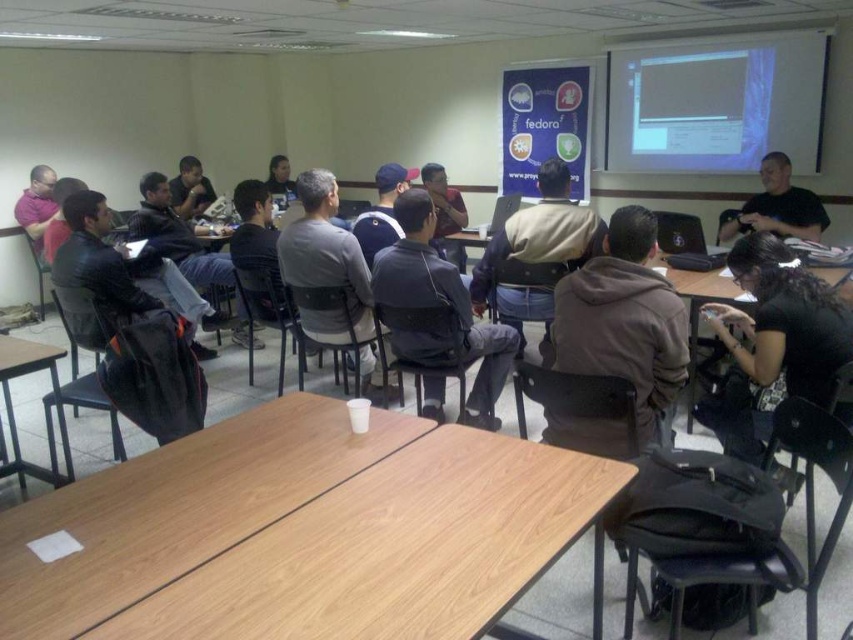
Question: Is brown wooden table at lower left thinner than matte black shirt at center?

Choices:
 (A) no
 (B) yes

Answer: (A)

Question: Which of these objects is positioned farthest from the brown wooden table at lower left?

Choices:
 (A) matte gray hoodie at center
 (B) matte black shirt at upper center

Answer: (B)

Question: Among these objects, which one is farthest from the camera?

Choices:
 (A) dark gray sweater at center
 (B) black fabric shirt at lower right

Answer: (A)

Question: Which of the following is the farthest from the observer?

Choices:
 (A) (762, 40)
 (B) (7, 461)
 (C) (780, 221)
 (D) (602, 352)

Answer: (A)

Question: Is dark gray sweater at center below matte pink shirt at left?

Choices:
 (A) yes
 (B) no

Answer: (A)

Question: Can you confirm if dark gray jacket at center is bigger than dark gray hoodie at center?

Choices:
 (A) no
 (B) yes

Answer: (A)